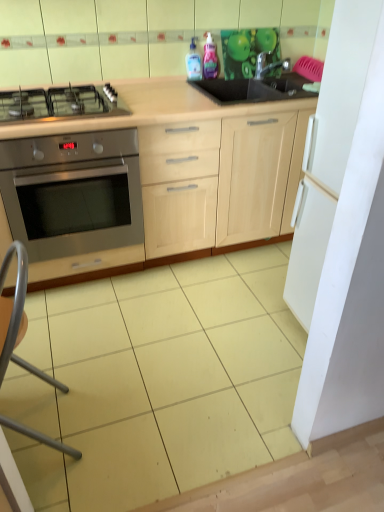
Find the location of a particular element. This screenshot has height=512, width=384. free location to the right of satin silver gas stove at left is located at coordinates (168, 102).